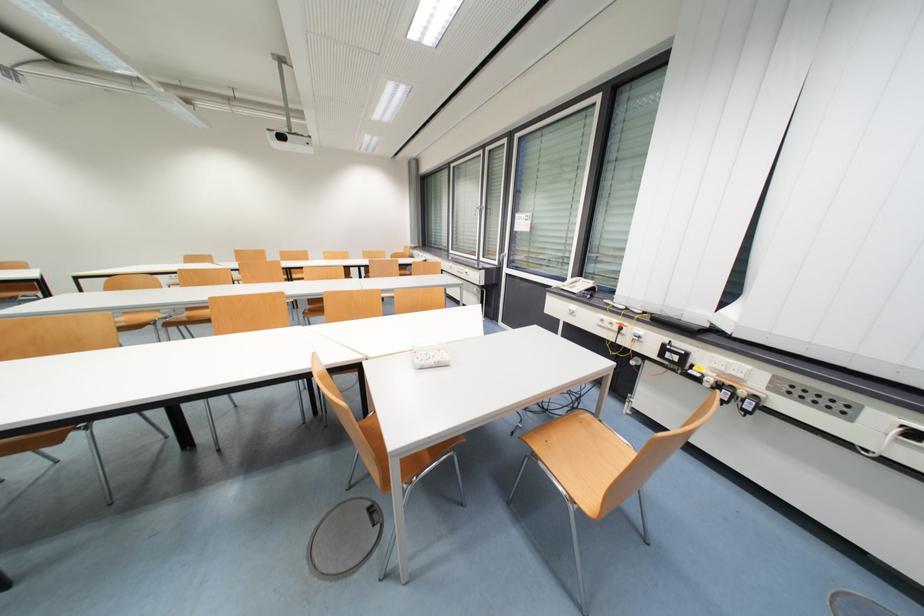
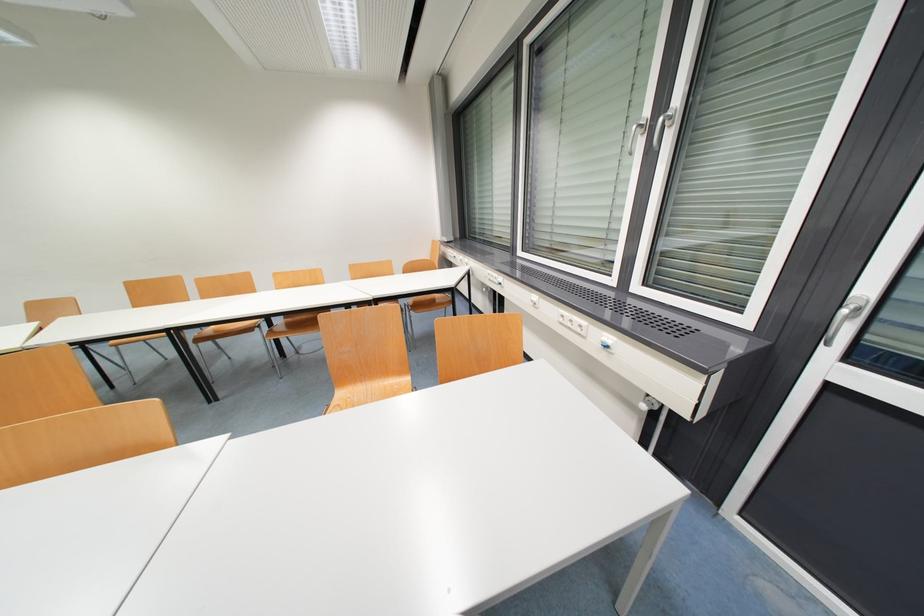
Question: Which direction would the cameraman need to move to produce the second image? Reply with the corresponding letter.

Choices:
 (A) Left
 (B) Right
 (C) Forward
 (D) Backward

Answer: (C)